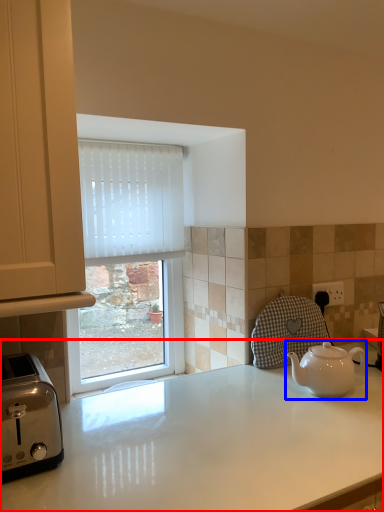
Question: Which of the following is the farthest to the observer, countertop (highlighted by a red box) or kettle (highlighted by a blue box)?

Choices:
 (A) countertop
 (B) kettle

Answer: (B)